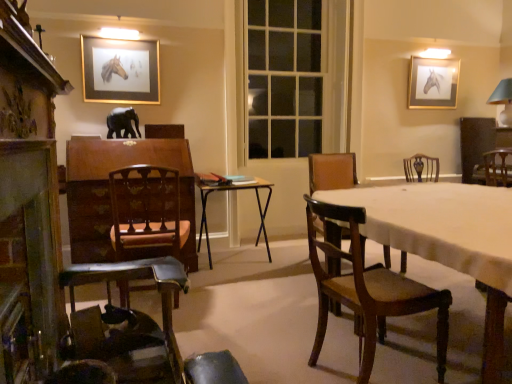
Question: Is metallic silver table at center next to wooden chair at left, marked as the 3th chair in a front-to-back arrangement, and touching it?

Choices:
 (A) no
 (B) yes

Answer: (A)

Question: From the image's perspective, would you say metallic silver table at center is shown under wooden chair at left, the fifth chair from the right?

Choices:
 (A) yes
 (B) no

Answer: (B)

Question: Can you confirm if metallic silver table at center is bigger than wooden chair at left, the third chair in the back-to-front sequence?

Choices:
 (A) yes
 (B) no

Answer: (A)

Question: From a real-world perspective, is metallic silver table at center positioned over wooden chair at left, marked as the 3th chair in a front-to-back arrangement, based on gravity?

Choices:
 (A) yes
 (B) no

Answer: (B)

Question: Is metallic silver table at center not close to wooden chair at left, marked as the 3th chair in a front-to-back arrangement?

Choices:
 (A) yes
 (B) no

Answer: (B)

Question: From a real-world perspective, relative to brown leather chair at center, the second chair in the back-to-front sequence, is wooden chair at left, the third chair in the back-to-front sequence, vertically above or below?

Choices:
 (A) below
 (B) above

Answer: (A)

Question: From their relative heights in the image, would you say wooden chair at left, the third chair in the back-to-front sequence, is taller or shorter than brown leather chair at center, positioned as the 4th chair in front-to-back order?

Choices:
 (A) short
 (B) tall

Answer: (A)

Question: Considering the positions of wooden chair at left, placed as the first chair when sorted from left to right, and brown leather chair at center, the second chair in the back-to-front sequence, in the image, is wooden chair at left, placed as the first chair when sorted from left to right, wider or thinner than brown leather chair at center, the second chair in the back-to-front sequence,?

Choices:
 (A) wide
 (B) thin

Answer: (B)

Question: Is wooden chair at left, placed as the first chair when sorted from left to right, inside or outside of brown leather chair at center, the 4th chair positioned from the left?

Choices:
 (A) inside
 (B) outside

Answer: (B)

Question: Considering their positions, is mahogany wood chair at center, arranged as the 3th chair when viewed from the left, located in front of or behind black matte elephant at center?

Choices:
 (A) behind
 (B) front

Answer: (B)

Question: From the image's perspective, is mahogany wood chair at center, the fifth chair in the back-to-front sequence, above or below black matte elephant at center?

Choices:
 (A) below
 (B) above

Answer: (A)

Question: Based on their sizes in the image, would you say mahogany wood chair at center, the 1th chair when ordered from front to back, is bigger or smaller than black matte elephant at center?

Choices:
 (A) small
 (B) big

Answer: (B)

Question: Is point (437, 357) closer or farther from the camera than point (111, 134)?

Choices:
 (A) closer
 (B) farther

Answer: (A)

Question: From the image's perspective, is wooden chair at left, the fifth chair from the right, above or below wooden chair at right, positioned as the first chair in right-to-left order?

Choices:
 (A) above
 (B) below

Answer: (B)

Question: Is wooden chair at left, the third chair in the back-to-front sequence, to the left or to the right of wooden chair at right, positioned as the first chair in right-to-left order, in the image?

Choices:
 (A) right
 (B) left

Answer: (B)